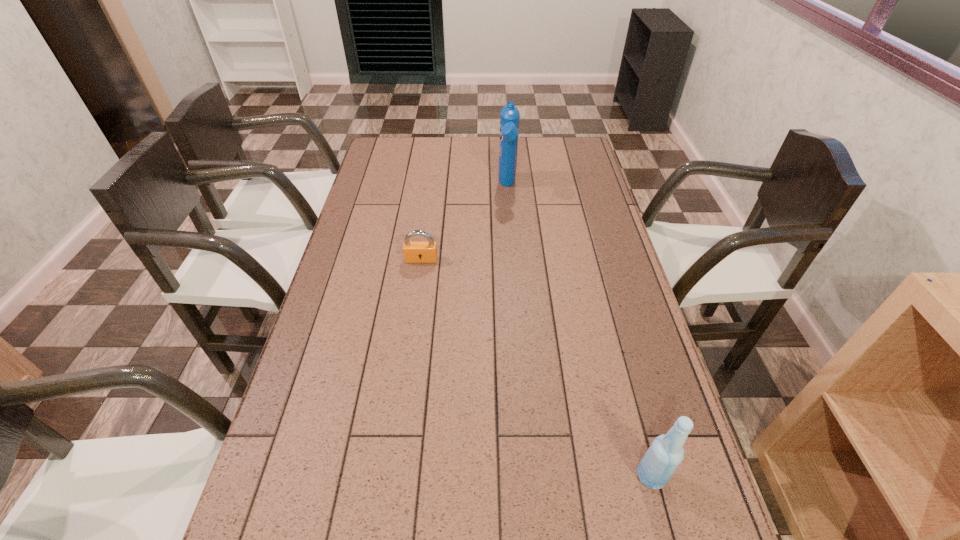
The image size is (960, 540). Identify the location of vacant space at the far edge of the desktop. (441, 164).

You are a GUI agent. You are given a task and a screenshot of the screen. Output one action in this format:
    pyautogui.click(x=<x>, y=<y>)
    Task: Click on the vacant point at the left edge
    This screenshot has width=960, height=540.
    Given the screenshot: What is the action you would take?
    pyautogui.click(x=351, y=244)

In the image, there is a desktop. Find the location of `free region at the right edge`. free region at the right edge is located at coordinates (595, 252).

Identify the location of vacant space at the far right corner. (560, 137).

Find the location of a particular element. This screenshot has height=540, width=960. unoccupied area between the farthest object and the padlock is located at coordinates (465, 222).

You are a GUI agent. You are given a task and a screenshot of the screen. Output one action in this format:
    pyautogui.click(x=<x>, y=<y>)
    Task: Click on the blank region between the leftmost object and the bottle
    
    Given the screenshot: What is the action you would take?
    pyautogui.click(x=536, y=368)

This screenshot has height=540, width=960. Identify the location of free spot between the nearest object and the shortest object. (536, 368).

Locate an element on the screen. This screenshot has height=540, width=960. vacant point located between the tallest object and the leftmost object is located at coordinates pos(465,222).

The image size is (960, 540). I want to click on empty space between the padlock and the second shortest object, so [536, 368].

Where is `vacant space that's between the tallest object and the second tallest object`? vacant space that's between the tallest object and the second tallest object is located at coordinates (579, 331).